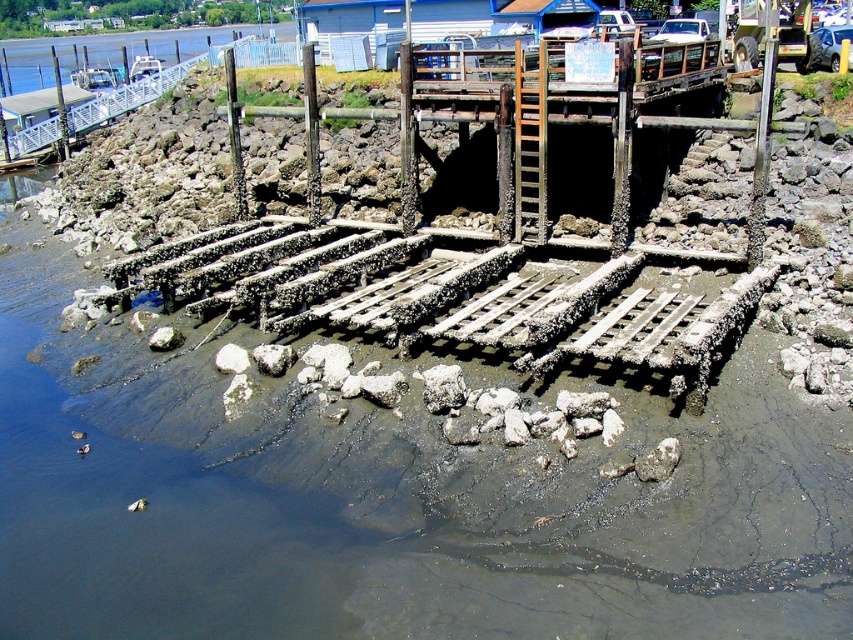
Can you confirm if rusty metal dock at lower center is smaller than rusty wood dock at center?

No, rusty metal dock at lower center is not smaller than rusty wood dock at center.

Who is higher up, rusty metal dock at lower center or rusty wood dock at center?

rusty wood dock at center

Does point (396, 284) come behind point (500, 212)?

No, it is in front of (500, 212).

You are a GUI agent. You are given a task and a screenshot of the screen. Output one action in this format:
    pyautogui.click(x=<x>, y=<y>)
    Task: Click on the rusty metal dock at lower center
    
    Given the screenshot: What is the action you would take?
    pyautogui.click(x=451, y=298)